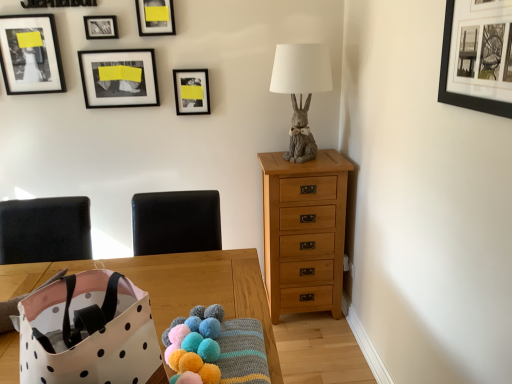
Question: Should I look upward or downward to see matte black picture frame at upper left, which appears as the 1th picture frame when viewed from the left?

Choices:
 (A) up
 (B) down

Answer: (A)

Question: Should I look upward or downward to see metallic silver picture frame at upper center, acting as the third picture frame starting from the back?

Choices:
 (A) up
 (B) down

Answer: (A)

Question: Considering the relative sizes of matte gray rabbit at upper right and matte black picture frame at upper center, arranged as the sixth picture frame when viewed from the front, in the image provided, is matte gray rabbit at upper right thinner than matte black picture frame at upper center, arranged as the sixth picture frame when viewed from the front,?

Choices:
 (A) yes
 (B) no

Answer: (B)

Question: From a real-world perspective, is matte gray rabbit at upper right below matte black picture frame at upper center, the fifth picture frame when ordered from left to right?

Choices:
 (A) no
 (B) yes

Answer: (B)

Question: Can you confirm if matte gray rabbit at upper right is positioned to the right of matte black picture frame at upper center, arranged as the sixth picture frame when viewed from the front?

Choices:
 (A) no
 (B) yes

Answer: (B)

Question: Is matte gray rabbit at upper right to the left of matte black picture frame at upper center, arranged as the sixth picture frame when viewed from the front, from the viewer's perspective?

Choices:
 (A) no
 (B) yes

Answer: (A)

Question: Does matte gray rabbit at upper right have a smaller size compared to matte black picture frame at upper center, the 2th picture frame positioned from the right?

Choices:
 (A) yes
 (B) no

Answer: (B)

Question: Does matte gray rabbit at upper right have a lesser height compared to matte black picture frame at upper center, which is the 1th picture frame from back to front?

Choices:
 (A) yes
 (B) no

Answer: (B)

Question: Is black leather armchair at center far away from black matte picture frame at upper right, which appears as the 1th picture frame when viewed from the right?

Choices:
 (A) no
 (B) yes

Answer: (B)

Question: Is black leather armchair at center wider than black matte picture frame at upper right, which ranks as the 1th picture frame in front-to-back order?

Choices:
 (A) yes
 (B) no

Answer: (A)

Question: From the image's perspective, is black leather armchair at center under black matte picture frame at upper right, which ranks as the 1th picture frame in front-to-back order?

Choices:
 (A) yes
 (B) no

Answer: (A)

Question: Does black leather armchair at center have a lesser width compared to black matte picture frame at upper right, which ranks as the 1th picture frame in front-to-back order?

Choices:
 (A) yes
 (B) no

Answer: (B)

Question: Is black leather armchair at center further to camera compared to black matte picture frame at upper right, the sixth picture frame viewed from the back?

Choices:
 (A) yes
 (B) no

Answer: (A)

Question: Is black leather armchair at center turned away from black matte picture frame at upper right, which ranks as the 1th picture frame in front-to-back order?

Choices:
 (A) yes
 (B) no

Answer: (B)

Question: Are fluffy yarn balls at lower center and matte gray rabbit at upper right beside each other?

Choices:
 (A) yes
 (B) no

Answer: (B)